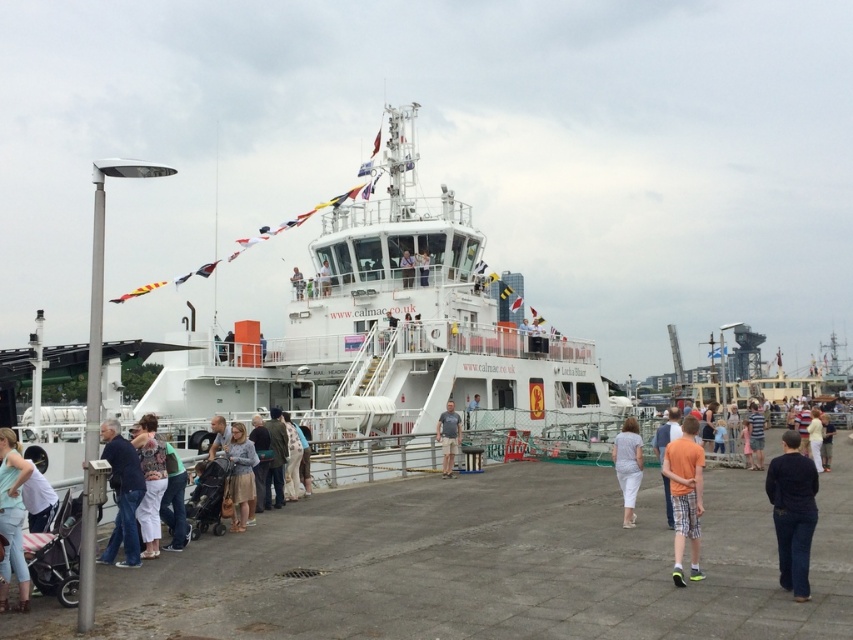
Between white cotton pants at center and light brown wooden pole at upper center, which one has less height?

With less height is light brown wooden pole at upper center.

Does white cotton pants at center appear on the right side of light brown wooden pole at upper center?

Indeed, white cotton pants at center is positioned on the right side of light brown wooden pole at upper center.

Who is more forward, (625,493) or (323,292)?

Point (625,493) is in front.

Identify the location of white cotton pants at center. The width and height of the screenshot is (853, 640). (628, 467).

Who is positioned more to the left, dark blue jeans at center or white cotton pants at center?

dark blue jeans at center is more to the left.

Who is shorter, dark blue jeans at center or white cotton pants at center?

Standing shorter between the two is white cotton pants at center.

Is point (117, 468) farther from camera compared to point (631, 460)?

No, (117, 468) is in front of (631, 460).

Locate an element on the screen. The height and width of the screenshot is (640, 853). dark blue jeans at center is located at coordinates (122, 493).

Does light blue denim jeans at lower left appear on the right side of light blue denim shorts at center?

Incorrect, light blue denim jeans at lower left is not on the right side of light blue denim shorts at center.

Between point (16, 563) and point (457, 442), which one is positioned in front?

Point (16, 563) is in front.

Between point (18, 483) and point (444, 451), which one is positioned in front?

Point (18, 483)

Where is `light blue denim jeans at lower left`? This screenshot has width=853, height=640. light blue denim jeans at lower left is located at coordinates (12, 516).